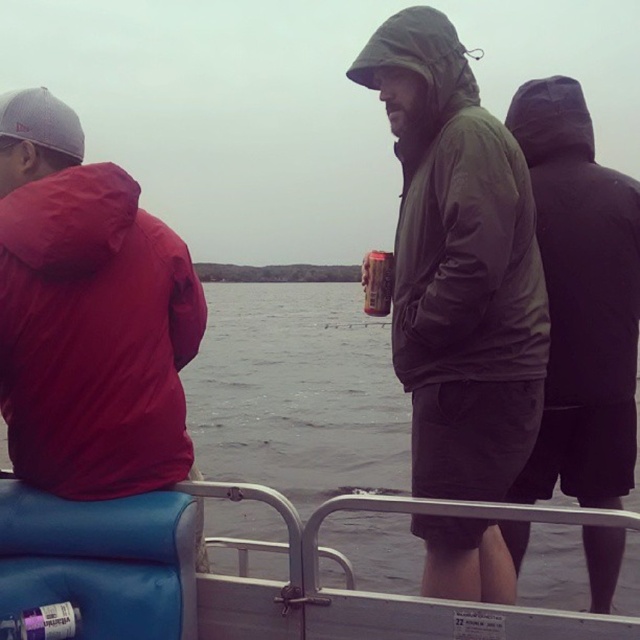
Consider the image. Measure the distance between matte red jacket at left and camera.

A distance of 1.67 meters exists between matte red jacket at left and camera.

What do you see at coordinates (88, 314) in the screenshot? This screenshot has width=640, height=640. I see `matte red jacket at left` at bounding box center [88, 314].

Locate an element on the screen. Image resolution: width=640 pixels, height=640 pixels. matte red jacket at left is located at coordinates (88, 314).

Between point (477, 172) and point (288, 595), which one is positioned behind?

The point (477, 172) is more distant.

Where is `matte green jacket at center`? matte green jacket at center is located at coordinates (458, 264).

Does gray water at center have a lesser height compared to metallic can at center?

Incorrect, gray water at center's height does not fall short of metallic can at center's.

Does gray water at center have a lesser width compared to metallic can at center?

In fact, gray water at center might be wider than metallic can at center.

Who is more distant from viewer, (404,492) or (365,284)?

Positioned behind is point (404,492).

What are the coordinates of `gray water at center` in the screenshot? It's located at (298, 394).